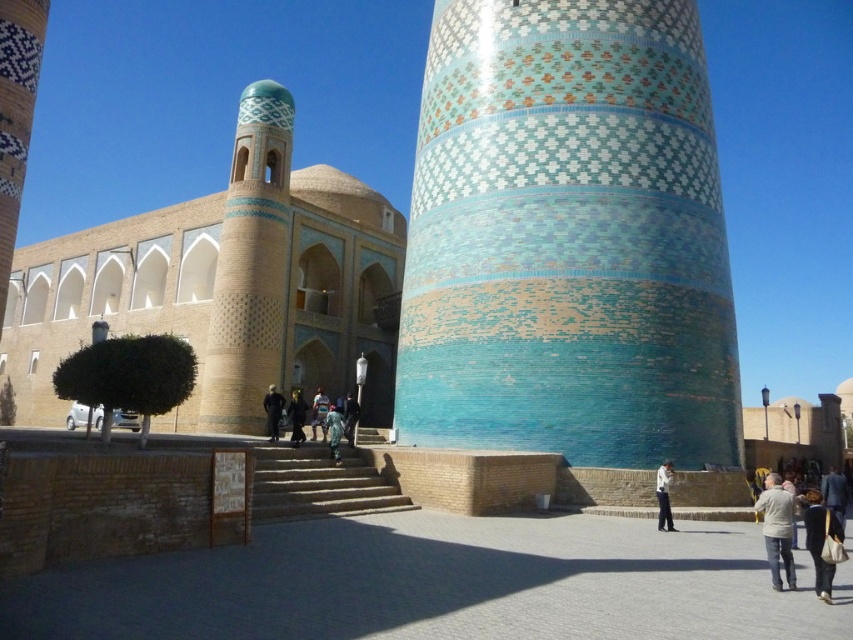
Does white cotton shirt at lower center appear on the right side of blue fabric dress at center?

Indeed, white cotton shirt at lower center is positioned on the right side of blue fabric dress at center.

Looking at this image, who is more distant from viewer, (x=665, y=477) or (x=352, y=435)?

The point (x=352, y=435) is more distant.

Which is in front, point (660, 490) or point (346, 426)?

Point (660, 490) is more forward.

Locate an element on the screen. white cotton shirt at lower center is located at coordinates (664, 497).

Who is more forward, (660, 525) or (273, 392)?

Point (660, 525)

At what (x,y) coordinates should I click in order to perform the action: click on white cotton shirt at lower center. Please return your answer as a coordinate pair (x, y). Looking at the image, I should click on (664, 497).

Is glazed ceramic tower at center to the right of dark blue suit at lower right from the viewer's perspective?

In fact, glazed ceramic tower at center is to the left of dark blue suit at lower right.

Between point (654, 289) and point (839, 490), which one is positioned behind?

Point (654, 289)

Identify the location of glazed ceramic tower at center. The image size is (853, 640). (567, 237).

This screenshot has height=640, width=853. I want to click on glazed ceramic tower at center, so click(567, 237).